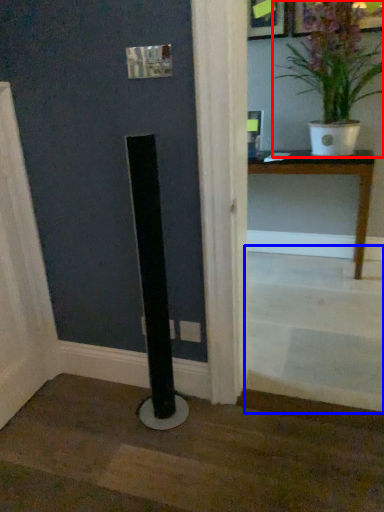
Question: Which of the following is the farthest to the observer, houseplant (highlighted by a red box) or stairwell (highlighted by a blue box)?

Choices:
 (A) houseplant
 (B) stairwell

Answer: (A)